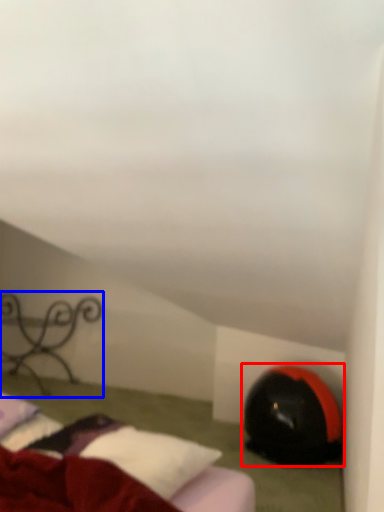
Question: Which object is closer to the camera taking this photo, bean bag chair (highlighted by a red box) or furniture (highlighted by a blue box)?

Choices:
 (A) bean bag chair
 (B) furniture

Answer: (A)